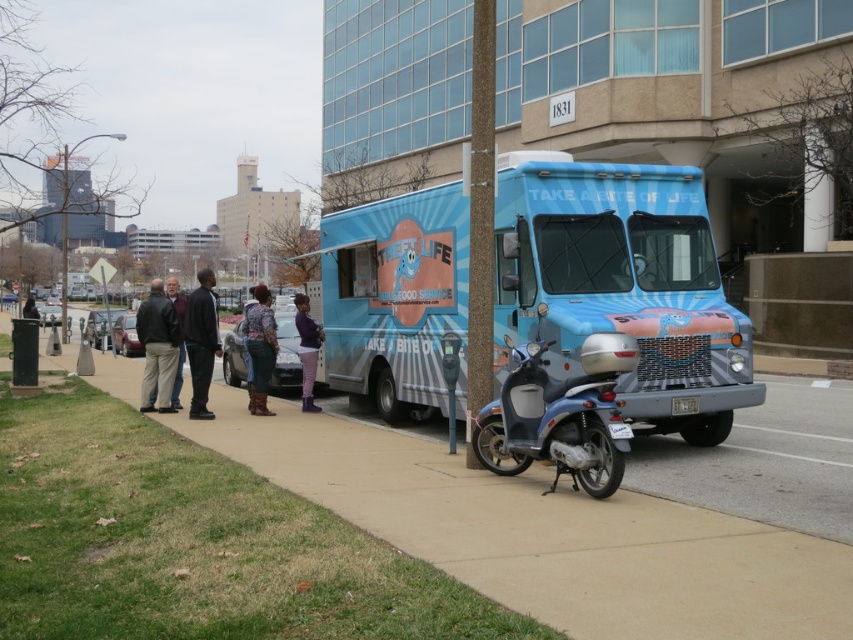
The height and width of the screenshot is (640, 853). Describe the element at coordinates (548, 534) in the screenshot. I see `smooth concrete sidewalk at center` at that location.

Is smooth concrete sidewalk at center positioned in front of patterned fabric jacket at center?

Yes, smooth concrete sidewalk at center is in front of patterned fabric jacket at center.

Identify the location of smooth concrete sidewalk at center. This screenshot has width=853, height=640. (548, 534).

Which of these two, purple matte sweater at center or dark brown leather jacket at center, stands shorter?

purple matte sweater at center

Which is in front, point (305, 323) or point (26, 314)?

Point (305, 323) is in front.

Identify the location of purple matte sweater at center. (306, 349).

Who is positioned more to the right, dark brown leather jacket at left or black leather jacket at center?

black leather jacket at center

This screenshot has width=853, height=640. Describe the element at coordinates (157, 348) in the screenshot. I see `dark brown leather jacket at left` at that location.

Who is more forward, (175,364) or (212,349)?

Positioned in front is point (212,349).

The image size is (853, 640). In order to click on dark brown leather jacket at left in this screenshot , I will do `click(157, 348)`.